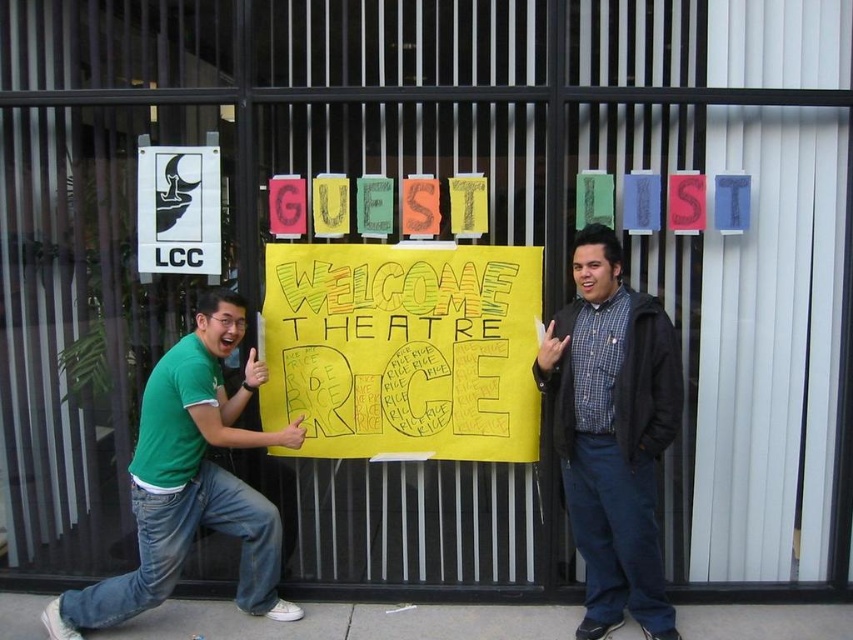
Who is positioned more to the left, yellow paper sign at center or plaid shirt at center?

Positioned to the left is yellow paper sign at center.

Locate an element on the screen. This screenshot has width=853, height=640. yellow paper sign at center is located at coordinates (403, 349).

Can you confirm if plaid shirt at center is positioned below green t-shirt at left?

Incorrect, plaid shirt at center is not positioned below green t-shirt at left.

Can you confirm if plaid shirt at center is positioned to the right of green t-shirt at left?

Correct, you'll find plaid shirt at center to the right of green t-shirt at left.

Is point (577, 342) positioned before point (84, 627)?

No, it is behind (84, 627).

Where is `plaid shirt at center`? The width and height of the screenshot is (853, 640). plaid shirt at center is located at coordinates tap(612, 433).

Can you confirm if green t-shirt at left is positioned below white paper at upper left?

Correct, green t-shirt at left is located below white paper at upper left.

Which of these two, green t-shirt at left or white paper at upper left, stands shorter?

Standing shorter between the two is white paper at upper left.

Measure the distance between point (x=236, y=417) and camera.

Point (x=236, y=417) is 3.78 meters from camera.

At what (x,y) coordinates should I click in order to perform the action: click on green t-shirt at left. Please return your answer as a coordinate pair (x, y). The width and height of the screenshot is (853, 640). Looking at the image, I should click on (190, 483).